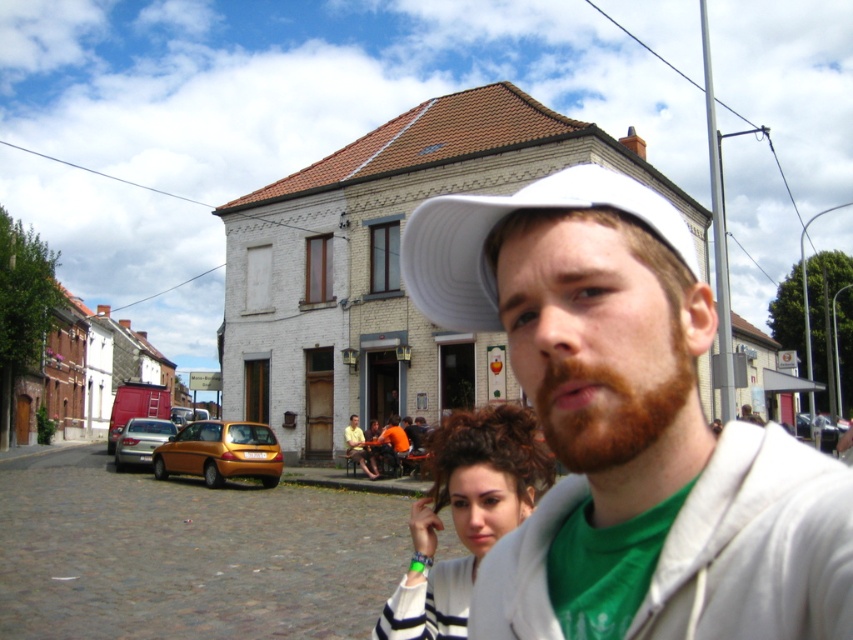
Question: Is white matte cap at center smaller than curly brown hair at center?

Choices:
 (A) yes
 (B) no

Answer: (B)

Question: Which is farther from the matte silver sedan at left?

Choices:
 (A) white matte cap at center
 (B) gold metallic hatchback at lower left
 (C) orange shirt at center
 (D) curly brown hair at center

Answer: (A)

Question: Which is farther from the curly brown hair at center?

Choices:
 (A) white matte baseball cap at center
 (B) white matte cap at center
 (C) matte silver sedan at left
 (D) orange shirt at center

Answer: (C)

Question: Which object appears farthest from the camera in this image?

Choices:
 (A) white matte cap at center
 (B) white matte baseball cap at center
 (C) curly brown hair at center
 (D) matte silver sedan at left

Answer: (D)

Question: Does white matte baseball cap at center appear on the right side of gold metallic hatchback at lower left?

Choices:
 (A) yes
 (B) no

Answer: (A)

Question: Does white matte cap at center appear on the left side of curly brown hair at center?

Choices:
 (A) yes
 (B) no

Answer: (B)